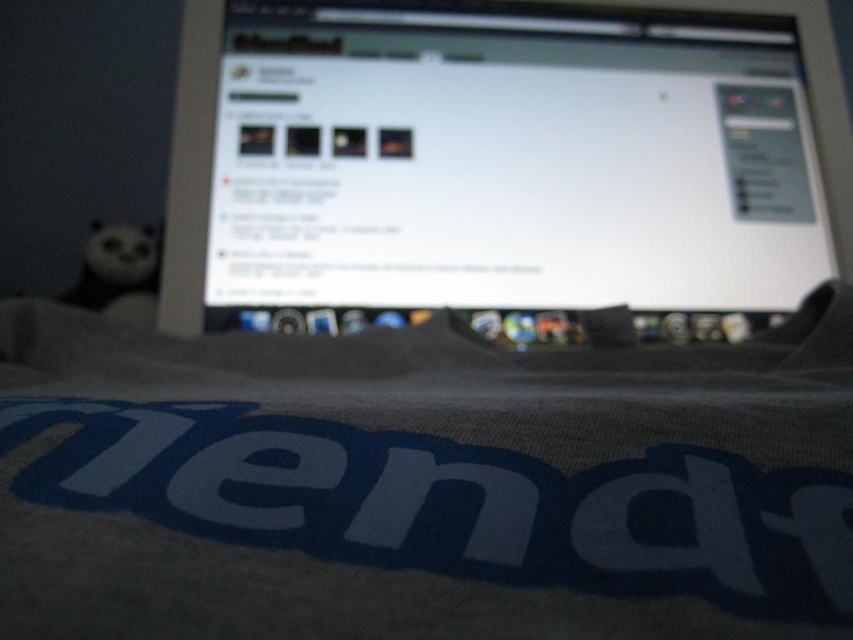
Question: Which object is farther from the camera taking this photo?

Choices:
 (A) matte plastic monitor at center
 (B) black plush panda at left

Answer: (B)

Question: Does matte plastic monitor at center have a smaller size compared to black plush panda at left?

Choices:
 (A) yes
 (B) no

Answer: (B)

Question: Among these objects, which one is nearest to the camera?

Choices:
 (A) black plush panda at left
 (B) matte plastic monitor at center

Answer: (B)

Question: Is matte plastic monitor at center further to the viewer compared to black plush panda at left?

Choices:
 (A) yes
 (B) no

Answer: (B)

Question: From the image, what is the correct spatial relationship of matte plastic monitor at center in relation to black plush panda at left?

Choices:
 (A) right
 (B) left

Answer: (A)